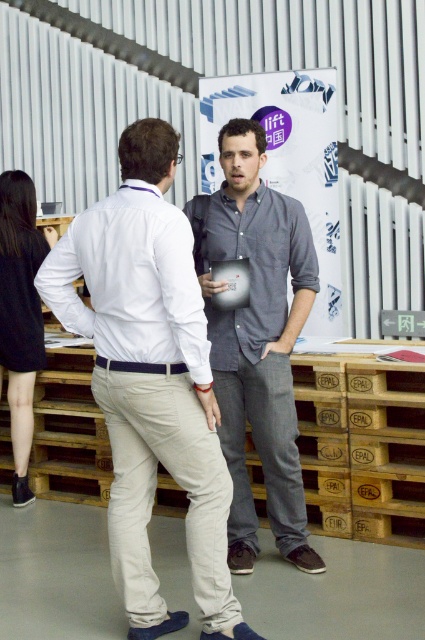
Is gray cotton shirt at center smaller than dark gray cotton shirt at center?

Actually, gray cotton shirt at center might be larger than dark gray cotton shirt at center.

This screenshot has width=425, height=640. Identify the location of gray cotton shirt at center. (257, 339).

Who is positioned more to the left, gray cotton shirt at center or black dress at left?

black dress at left is more to the left.

Which of these two, gray cotton shirt at center or black dress at left, stands shorter?

With less height is black dress at left.

Where is `gray cotton shirt at center`? gray cotton shirt at center is located at coordinates (257, 339).

Which is behind, point (45, 266) or point (266, 248)?

Point (266, 248)

Can you confirm if white matte shirt at center is smaller than dark gray cotton shirt at center?

No, white matte shirt at center is not smaller than dark gray cotton shirt at center.

Who is more forward, (187, 237) or (226, 346)?

Positioned in front is point (187, 237).

This screenshot has height=640, width=425. I want to click on white matte shirt at center, so click(130, 282).